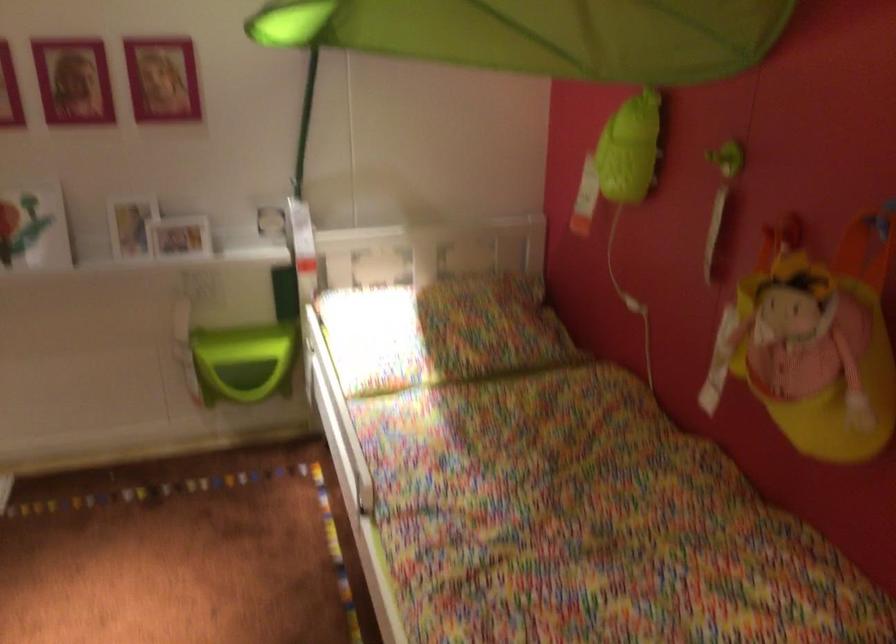
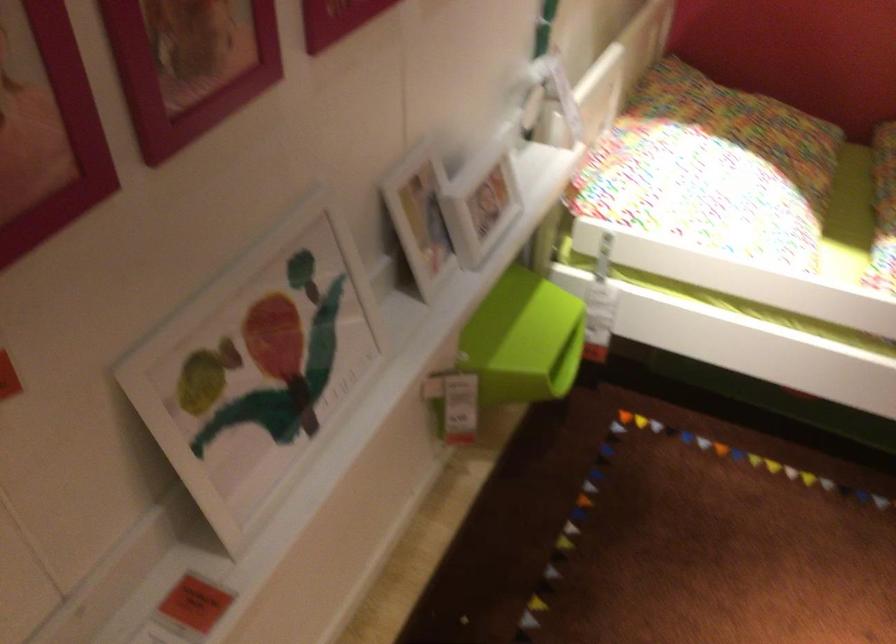
Where in the second image is the point corresponding to the point at 385,310 from the first image?

(712, 169)